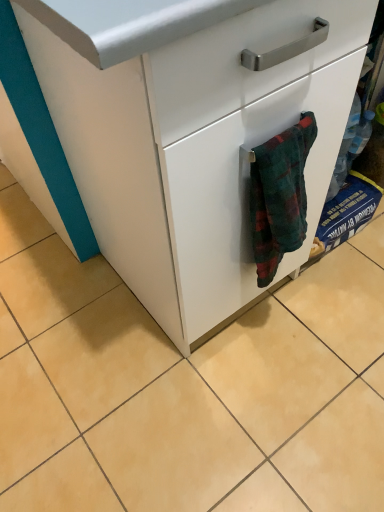
I want to click on free space in front of white matte cabinet at center, so click(273, 388).